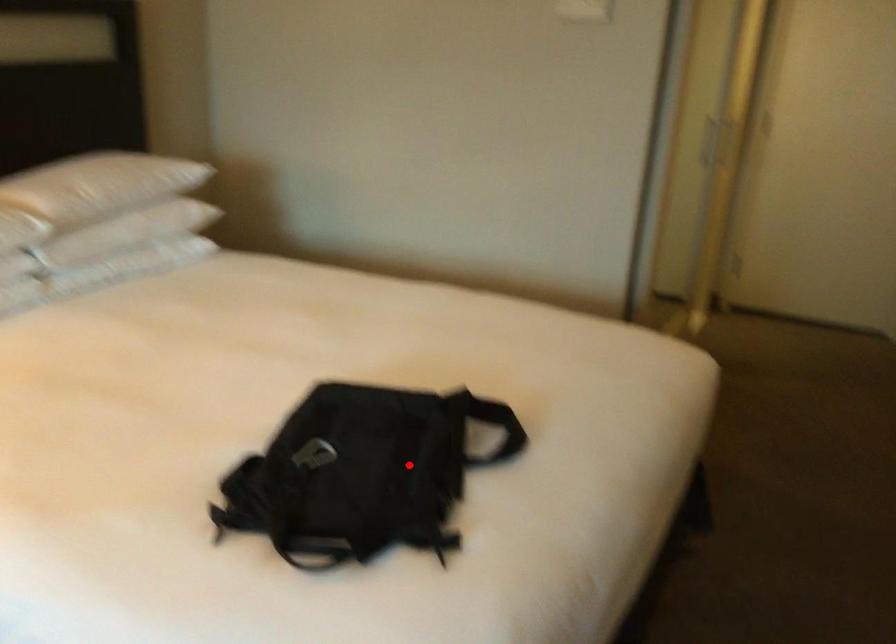
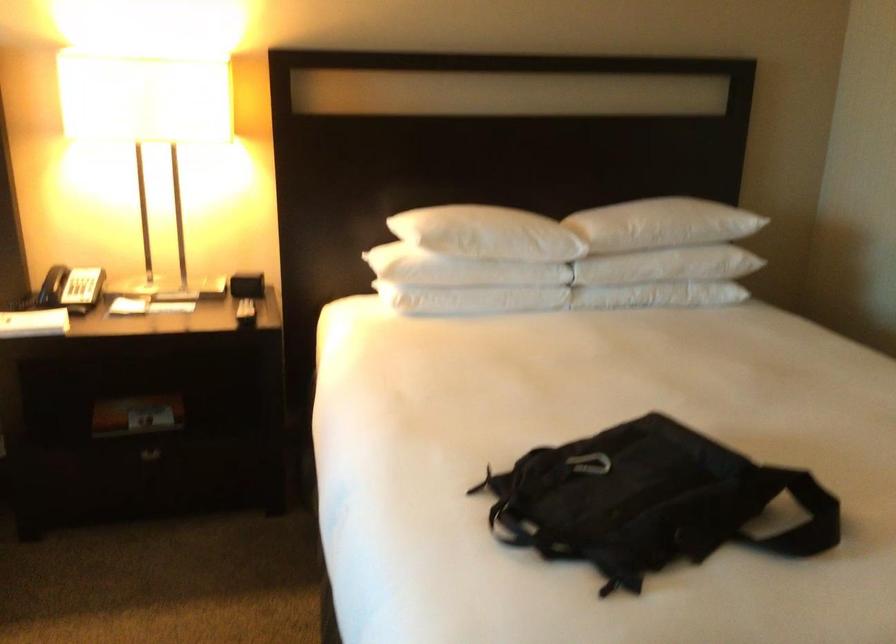
The point at the highlighted location is marked in the first image. Where is the corresponding point in the second image?

(649, 502)